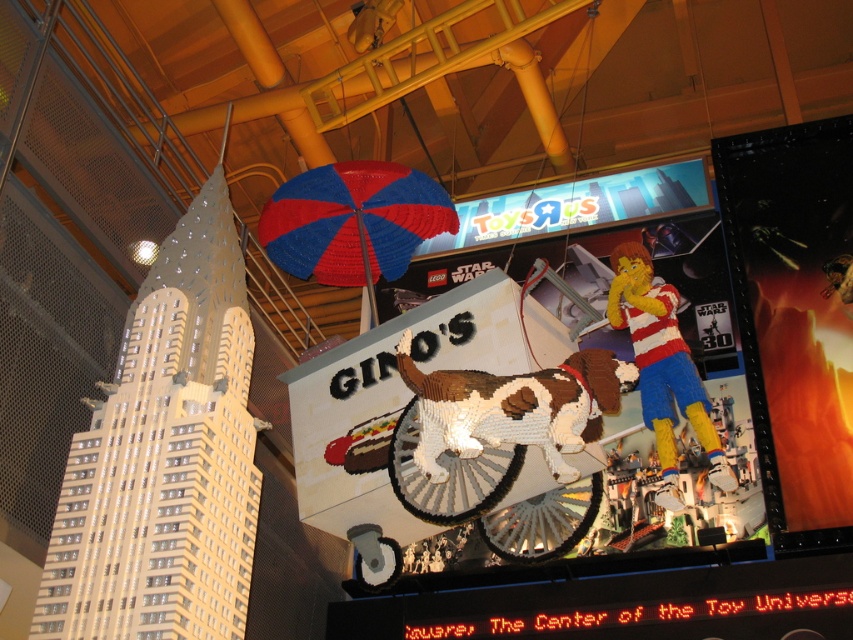
Question: Among these points, which one is nearest to the camera?

Choices:
 (A) [x=706, y=477]
 (B) [x=631, y=172]
 (C) [x=410, y=232]

Answer: (A)

Question: Which object is closer to the camera taking this photo?

Choices:
 (A) plush yellow and red toy at center
 (B) matte plastic signboard at center
 (C) brown and white plastic dog at center

Answer: (C)

Question: Estimate the real-world distances between objects in this image. Which object is closer to the plush yellow and red toy at center?

Choices:
 (A) matte plastic signboard at center
 (B) blue/red plastic umbrella at center
 (C) brown and white plastic dog at center

Answer: (C)

Question: Does brown and white plastic dog at center have a smaller size compared to blue/red plastic umbrella at center?

Choices:
 (A) yes
 (B) no

Answer: (A)

Question: Is brown and white plastic dog at center wider than plush yellow and red toy at center?

Choices:
 (A) no
 (B) yes

Answer: (B)

Question: Is brown and white plastic dog at center above plush yellow and red toy at center?

Choices:
 (A) yes
 (B) no

Answer: (B)